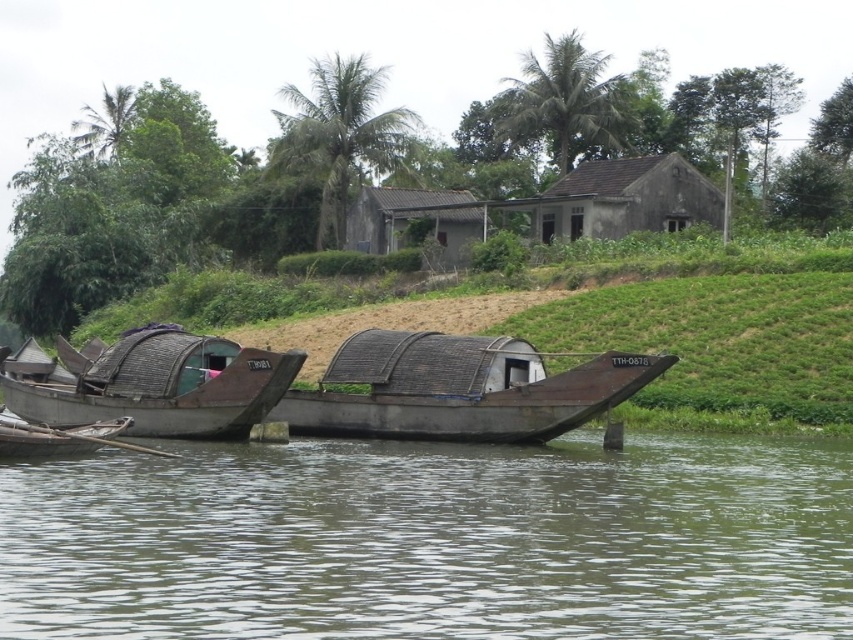
Question: Does brown matte water at center have a larger size compared to gray corrugated metal hut at center?

Choices:
 (A) no
 (B) yes

Answer: (A)

Question: Estimate the real-world distances between objects in this image. Which object is closer to the gray corrugated metal hut at center?

Choices:
 (A) rustic wooden hut at center
 (B) brown matte water at center
 (C) rusty metal canoe at lower left
 (D) rusty metal boat at center

Answer: (A)

Question: Which point appears farthest from the camera in this image?

Choices:
 (A) (582, 504)
 (B) (50, 429)

Answer: (B)

Question: Is rusty metal boat at center wider than gray corrugated metal hut at center?

Choices:
 (A) no
 (B) yes

Answer: (B)

Question: Estimate the real-world distances between objects in this image. Which object is closer to the gray corrugated metal hut at center?

Choices:
 (A) rusty metal canoe at lower left
 (B) rusty metal boat at left
 (C) rustic wooden hut at center
 (D) brown matte water at center

Answer: (C)

Question: Is rusty metal boat at center positioned at the back of rusty metal boat at left?

Choices:
 (A) no
 (B) yes

Answer: (B)